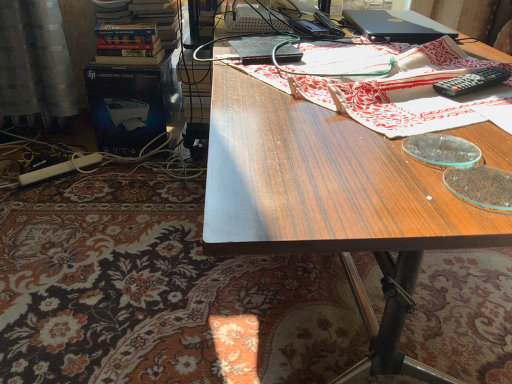
At what (x,y) coordinates should I click in order to perform the action: click on free space above wooden desk at center (from a real-world perspective). Please return your answer as a coordinate pair (x, y). The image size is (512, 384). Looking at the image, I should click on (372, 66).